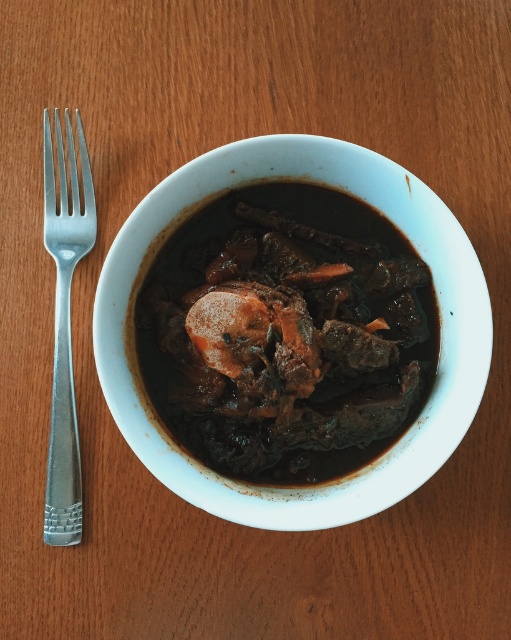
You are a photographer trying to capture the meal in the white ceramic bowl. You notice two points marked in the image at coordinates point (257, 323) and point (88, 202). Which point should you focus on to ensure the bowl is in sharp focus?

Point (257, 323) is closer to the camera than point (88, 202), so focusing on point (257, 323) will ensure the bowl is in sharp focus.

You are a chef standing at a kitchen counter, and you need to reach the brown matte stew at center. If your arm can extend 3 feet, can you comfortably reach it?

The brown matte stew at center is 3.81 feet away from the viewer. Since your arm can only extend 3 feet, you cannot comfortably reach it without moving closer.

You are a chef preparing to serve a dish. You have a brown matte stew at center and a silver metallic fork at left. Which item is wider?

The brown matte stew at center is wider than the silver metallic fork at left.